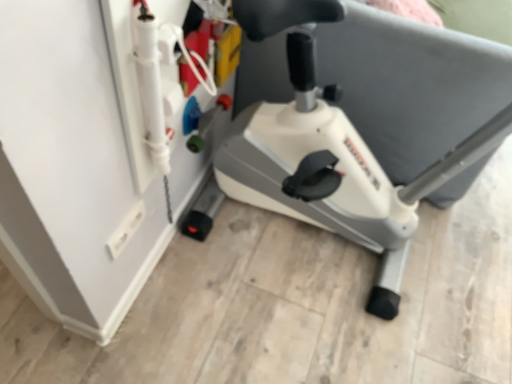
This screenshot has height=384, width=512. What are the coordinates of `vacant area that is in front of white plastic stationary bicycle at center` in the screenshot? It's located at (303, 338).